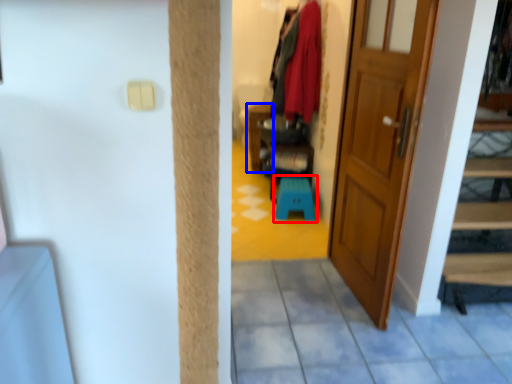
Question: Which object appears closest to the camera in this image, step stool (highlighted by a red box) or furniture (highlighted by a blue box)?

Choices:
 (A) step stool
 (B) furniture

Answer: (A)